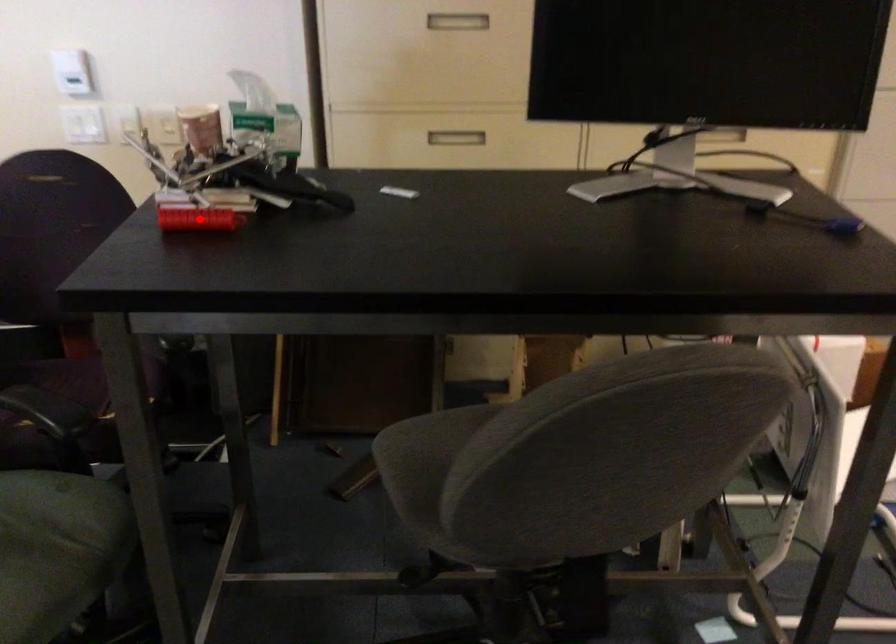
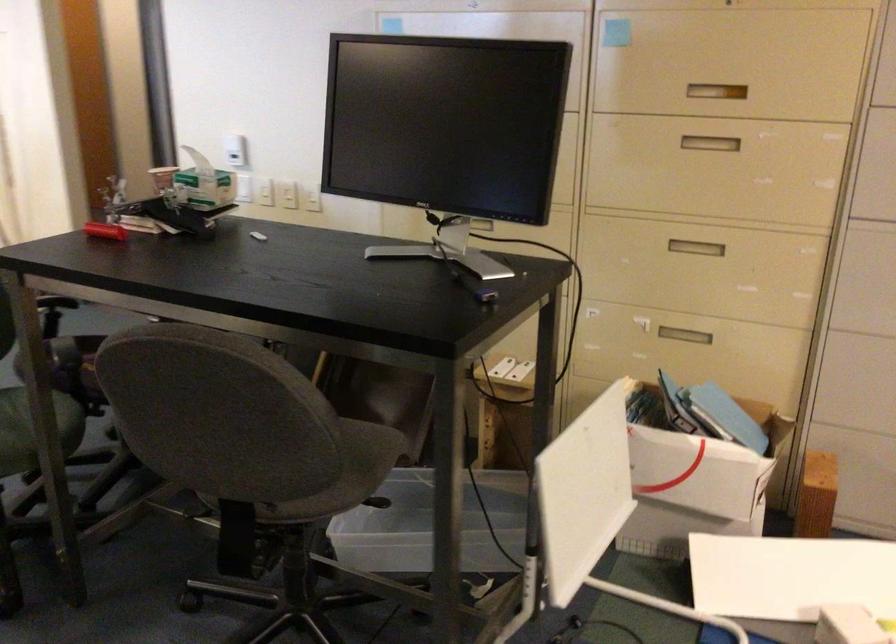
Question: I am providing you with two images of the same scene from different viewpoints. Given a red point in image1, look at the same physical point in image2. Is it:

Choices:
 (A) Closer to the viewpoint
 (B) Farther from the viewpoint

Answer: (B)